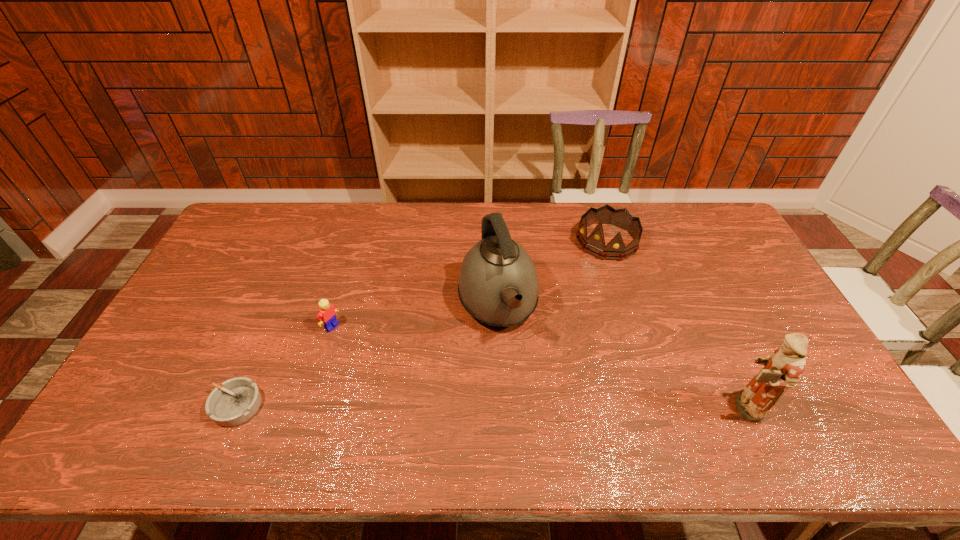
I want to click on free location that satisfies the following two spatial constraints: 1. on the back side of the fourth object from left to right; 2. on the right side of the kettle, so click(495, 241).

Locate an element on the screen. The height and width of the screenshot is (540, 960). vacant space that satisfies the following two spatial constraints: 1. on the back side of the kettle; 2. on the right side of the farthest object is located at coordinates click(495, 241).